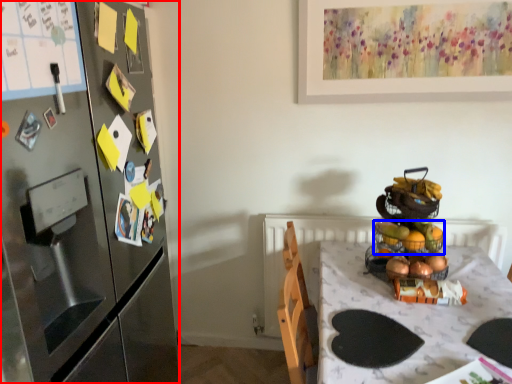
Question: Which point is closer to the camera, cabinetry (highlighted by a red box) or basket (highlighted by a blue box)?

Choices:
 (A) cabinetry
 (B) basket

Answer: (A)